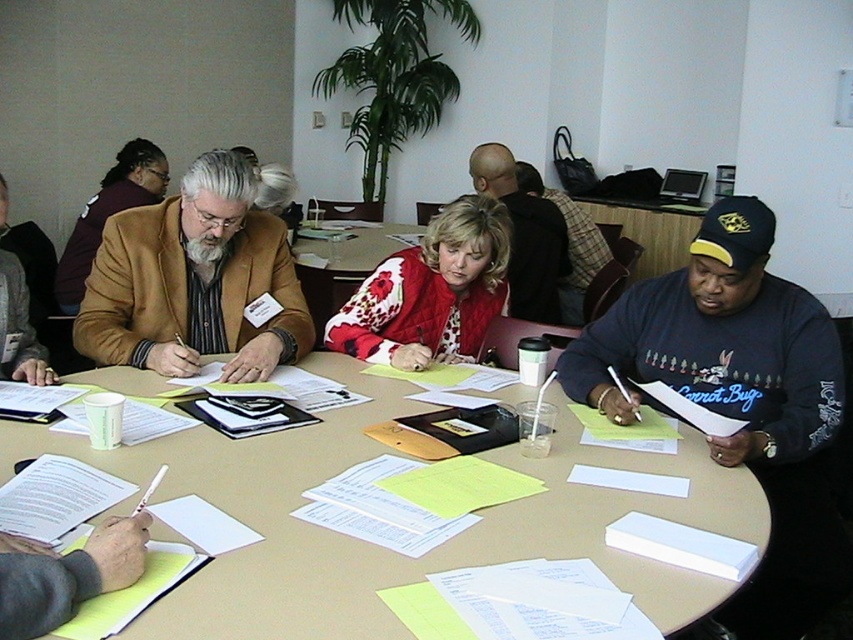
Is point (635, 342) closer to camera compared to point (265, 353)?

No, (635, 342) is further to viewer.

Between point (602, 385) and point (117, 269), which one is positioned in front?

Point (602, 385) is in front.

Which is behind, point (730, 278) or point (165, 260)?

Point (165, 260)

Locate an element on the screen. The height and width of the screenshot is (640, 853). dark blue sweatshirt at lower right is located at coordinates (721, 342).

Does red floral sweater at center appear on the left side of dark blue sweatshirt at center?

Indeed, red floral sweater at center is positioned on the left side of dark blue sweatshirt at center.

Does red floral sweater at center have a lesser width compared to dark blue sweatshirt at center?

In fact, red floral sweater at center might be wider than dark blue sweatshirt at center.

Does point (467, 262) lie in front of point (512, 218)?

Yes, it is in front of point (512, 218).

Locate an element on the screen. The image size is (853, 640). red floral sweater at center is located at coordinates (431, 291).

Does dark blue sweatshirt at center appear on the right side of floral-patterned fabric at center?

Yes, dark blue sweatshirt at center is to the right of floral-patterned fabric at center.

From the picture: Who is positioned more to the left, dark blue sweatshirt at center or floral-patterned fabric at center?

floral-patterned fabric at center

Measure the distance between point (531,285) and camera.

Point (531,285) is 3.43 meters from camera.

Where is `dark blue sweatshirt at center`? Image resolution: width=853 pixels, height=640 pixels. dark blue sweatshirt at center is located at coordinates (525, 236).